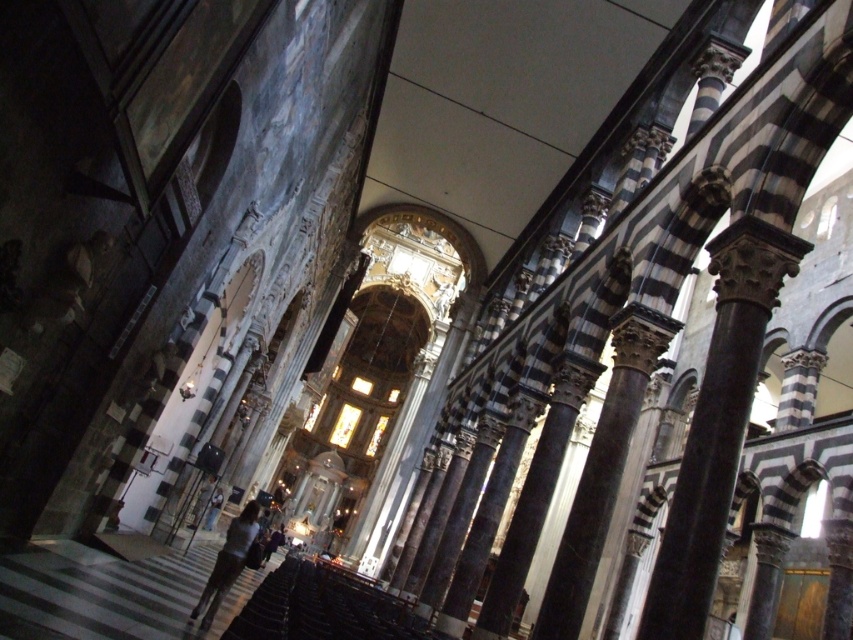
Who is more distant from viewer, (619, 470) or (245, 532)?

The point (245, 532) is behind.

Is black and white striped column at center-right taller than dark brown leather jacket at lower center?

Yes, black and white striped column at center-right is taller than dark brown leather jacket at lower center.

What do you see at coordinates (602, 468) in the screenshot? I see `black and white striped column at center-right` at bounding box center [602, 468].

Identify the location of black and white striped column at center-right. (602, 468).